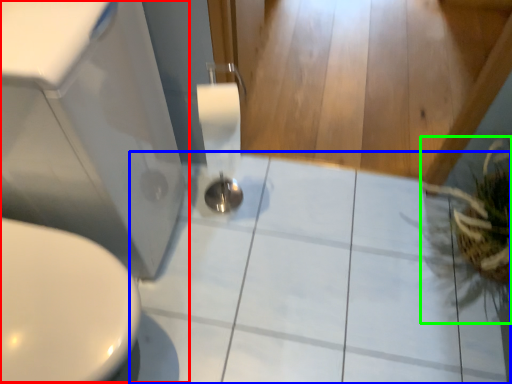
Question: Considering the real-world distances, which object is farthest from sink (highlighted by a red box)? ceramic tile (highlighted by a blue box) or plant (highlighted by a green box)?

Choices:
 (A) ceramic tile
 (B) plant

Answer: (B)